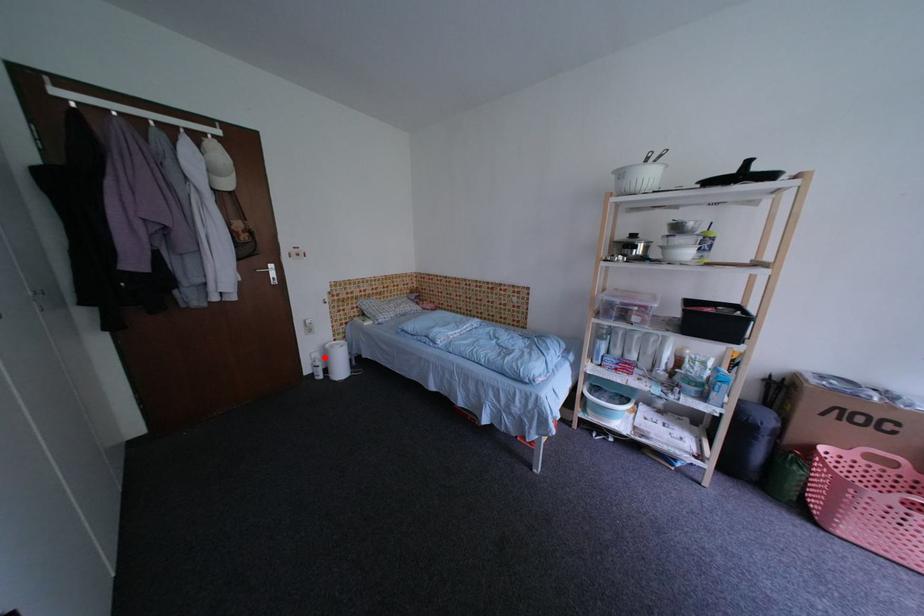
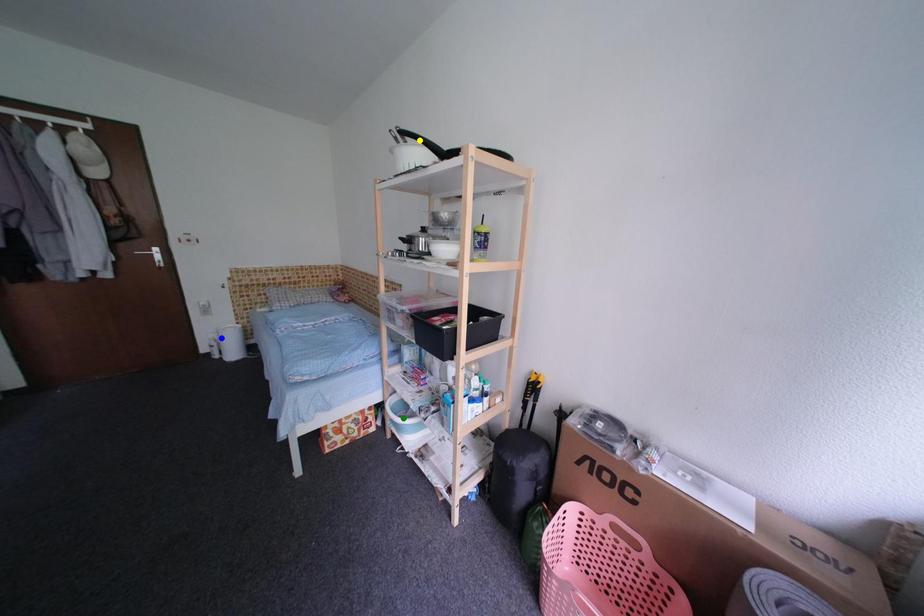
Question: I am providing you with two images of the same scene from different viewpoints. A red point is marked on the first image. You are given multiple points on the second image. Which point in image 2 represents the same 3d spot as the red point in image 1?

Choices:
 (A) green point
 (B) yellow point
 (C) blue point

Answer: (C)